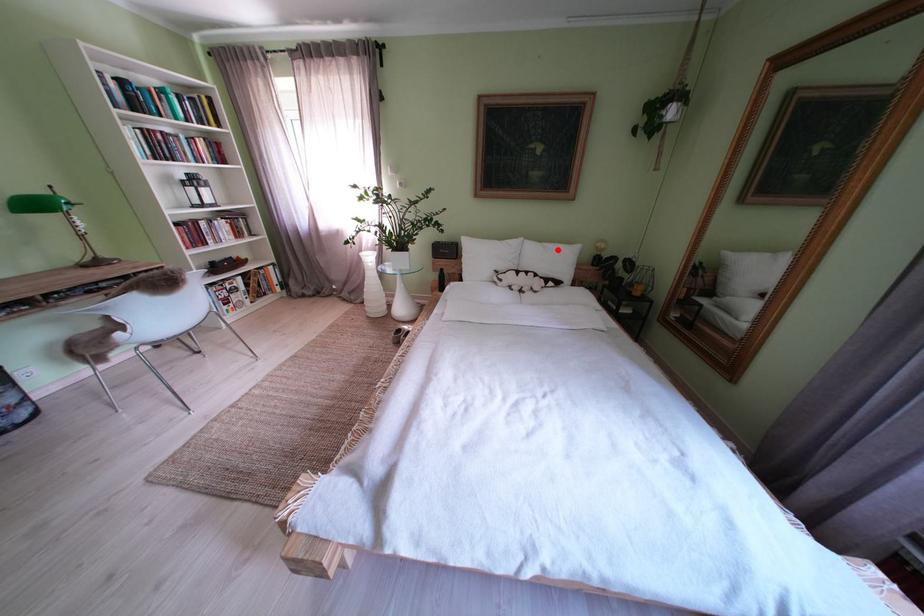
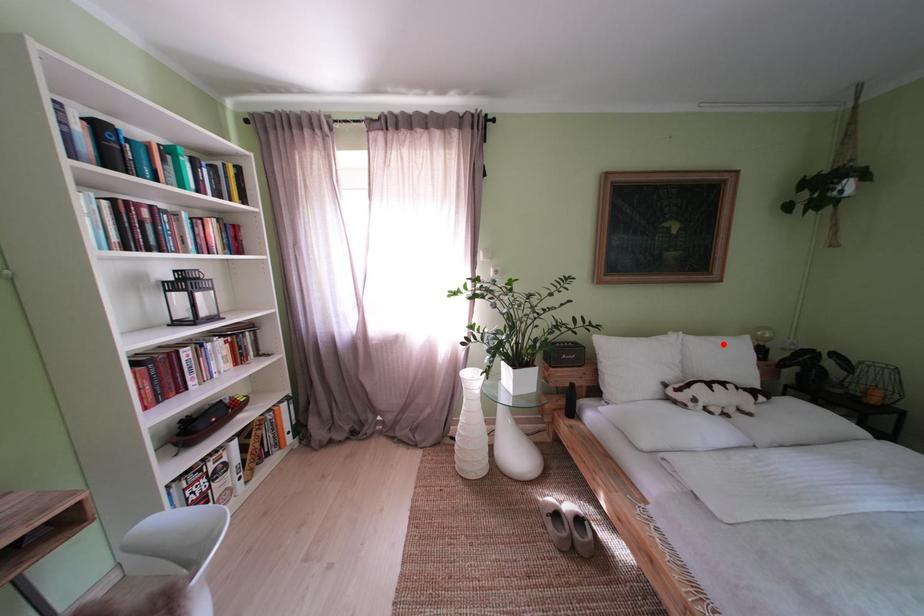
I am providing you with two images of the same scene from different viewpoints. A red point is marked on the first image and another point is marked on the second image. Are the points marked in image1 and image2 representing the same 3D position?

Yes